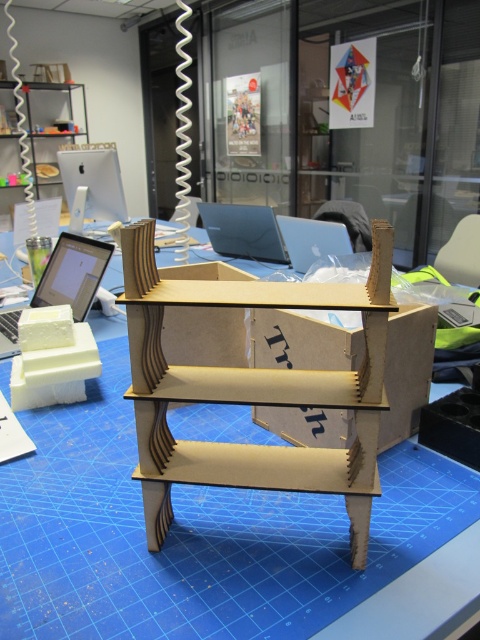
You are a researcher in the lab and need to access both the silver metallic laptop at left and the satin silver laptop at center. Which laptop should you approach first to reach the one farther away without moving the other?

You should approach the silver metallic laptop at left first because it is closer to you, so reaching the satin silver laptop at center afterward will not require moving the closer one.

Looking at this image, you are organizing a workspace and need to place the satin silver laptop at center on the wooden shelf at center. Based on the size of the shelf and laptop, will the laptop fit on the shelf?

The wooden shelf at center is larger in size than the satin silver laptop at center, so the laptop will fit on the shelf.